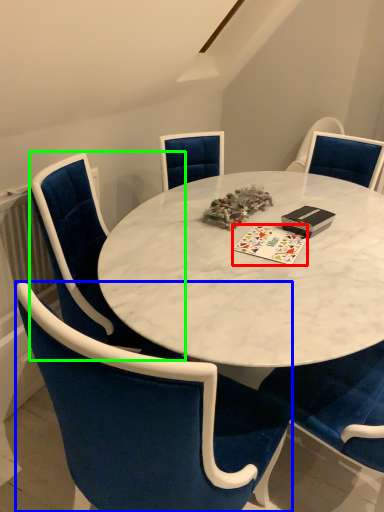
Question: Which is farther away from card game (highlighted by a red box)? chair (highlighted by a blue box) or chair (highlighted by a green box)?

Choices:
 (A) chair
 (B) chair

Answer: (A)